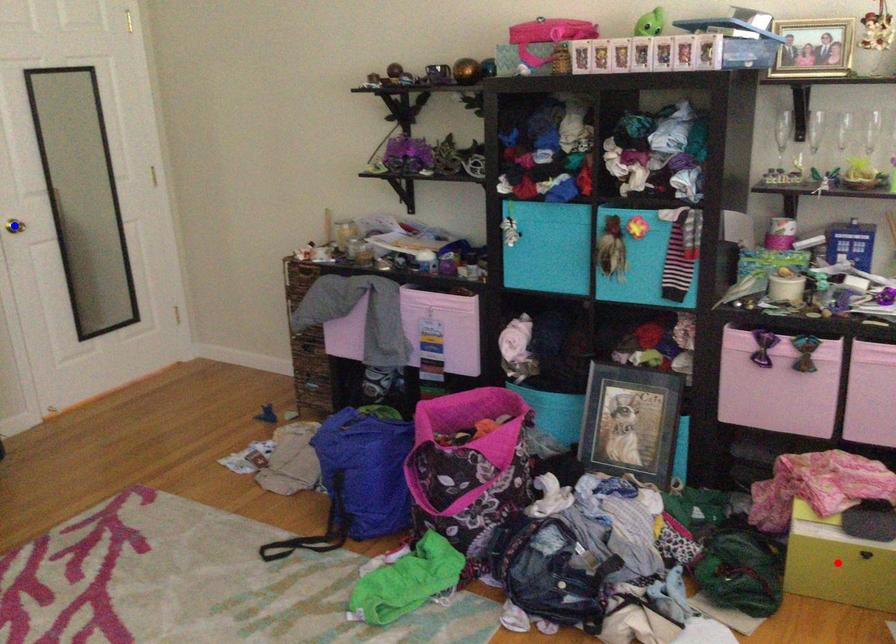
Question: Two points are marked on the image. Which point is closer to the camera?

Choices:
 (A) Blue point is closer.
 (B) Red point is closer.

Answer: (B)